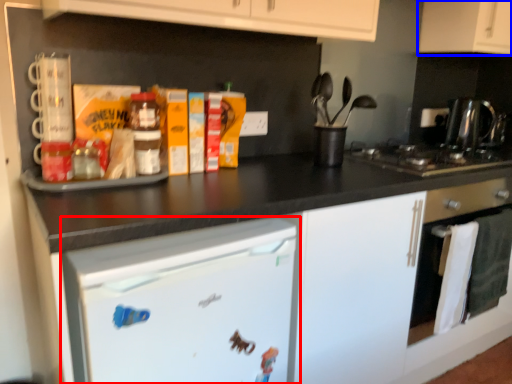
Question: Which object appears closest to the camera in this image, home appliance (highlighted by a red box) or cabinetry (highlighted by a blue box)?

Choices:
 (A) home appliance
 (B) cabinetry

Answer: (A)